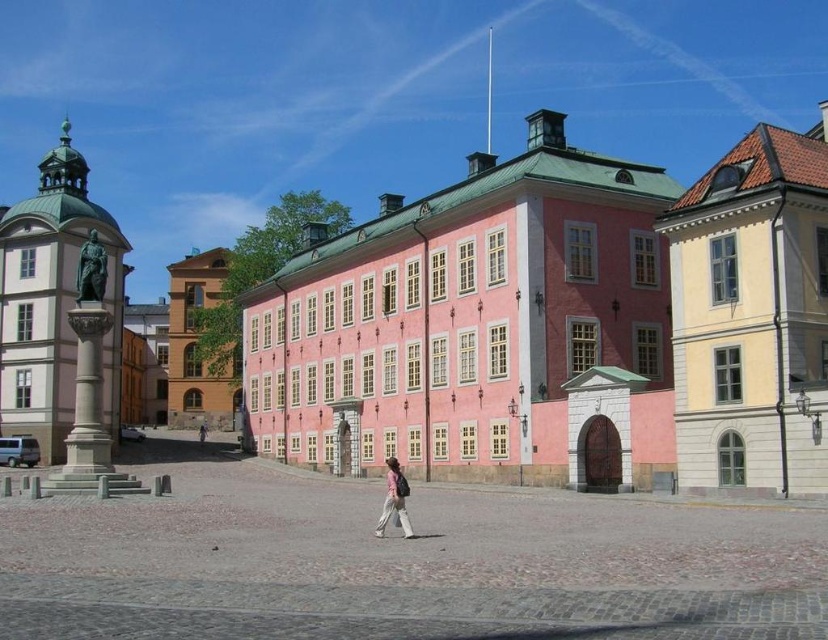
You are an architect analyzing the urban layout. Given the pink matte building at center and the yellow matte building at upper right, which one would require more construction materials if they were to be built from scratch, based on their sizes?

The yellow matte building at upper right requires more construction materials since it is larger in size compared to the pink matte building at center.

You are a city planner reviewing the layout of this urban area. The matte yellow building at center is crucial for public services. Given its coordinates at point 0.539, 0.237, how does its position affect accessibility from the main road running along the bottom edge of the image?

The matte yellow building at center is positioned centrally at coordinates (x=195, y=344), which places it directly along the main road. This central location ensures easy accessibility from the main road, making it convenient for public services.